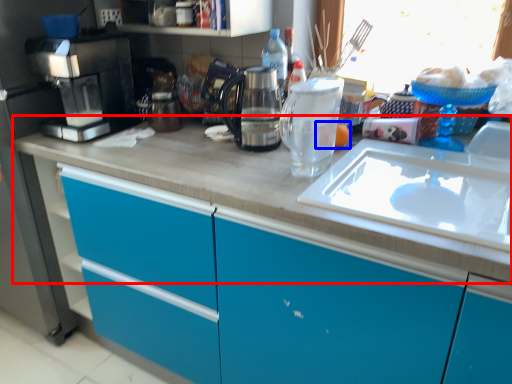
Question: Among these objects, which one is nearest to the camera, countertop (highlighted by a red box) or food (highlighted by a blue box)?

Choices:
 (A) countertop
 (B) food

Answer: (A)